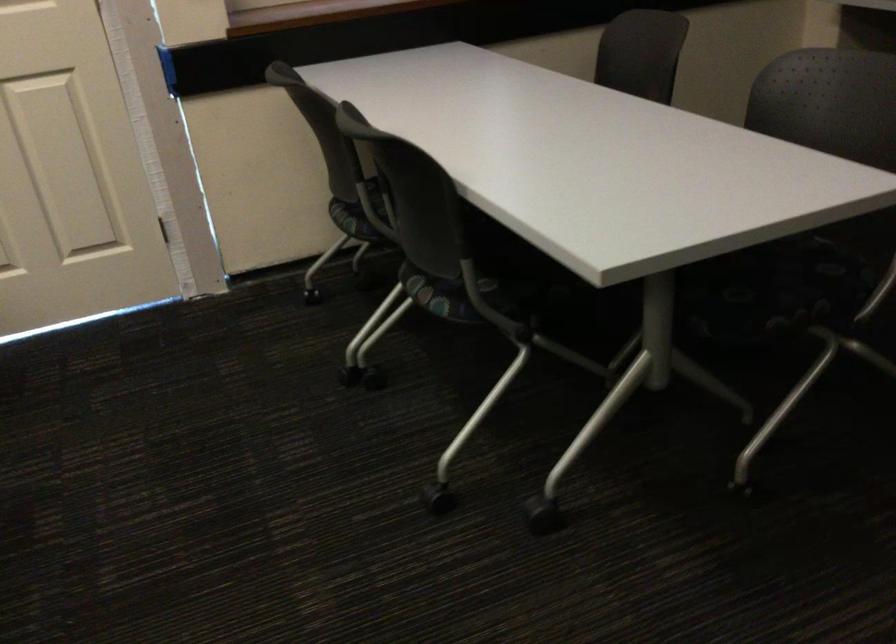
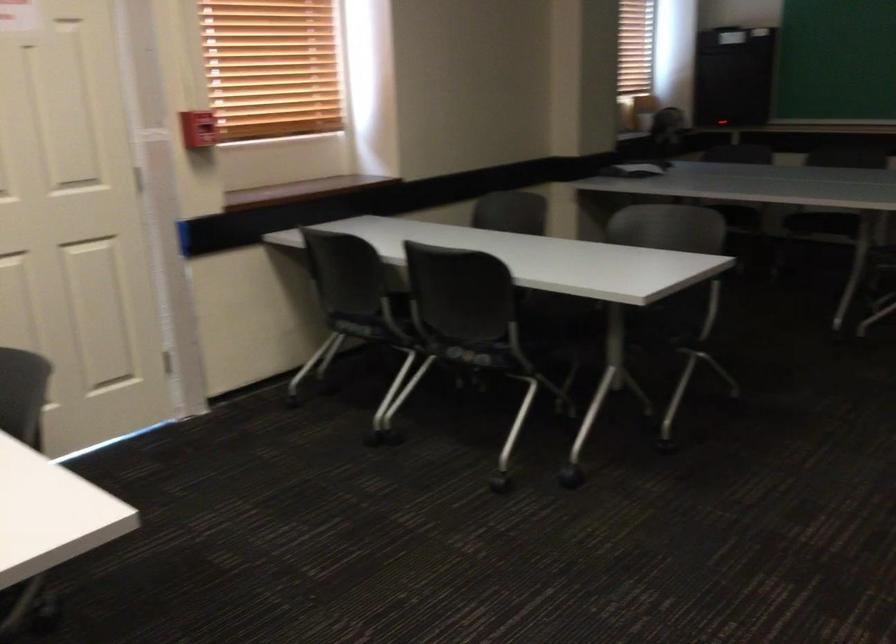
Find the pixel in the second image that matches point (444, 290) in the first image.

(474, 354)